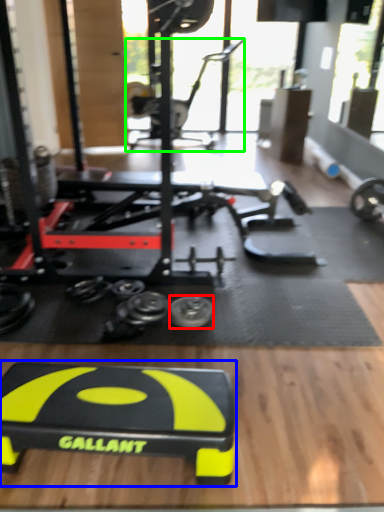
Question: Based on their relative distances, which object is farther from tire (highlighted by a red box)? Choose from sport equipment (highlighted by a blue box) and sport equipment (highlighted by a green box).

Choices:
 (A) sport equipment
 (B) sport equipment

Answer: (B)